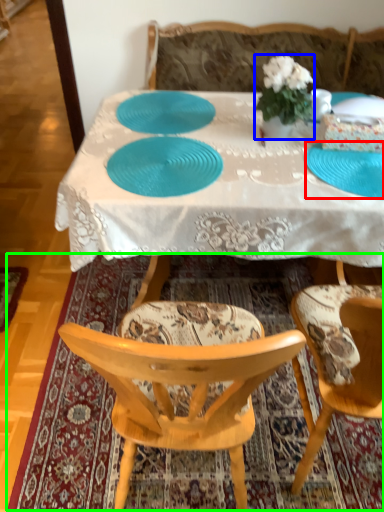
Question: Estimate the real-world distances between objects in this image. Which object is closer to plate (highlighted by a red box), houseplant (highlighted by a blue box) or mat (highlighted by a green box)?

Choices:
 (A) houseplant
 (B) mat

Answer: (A)